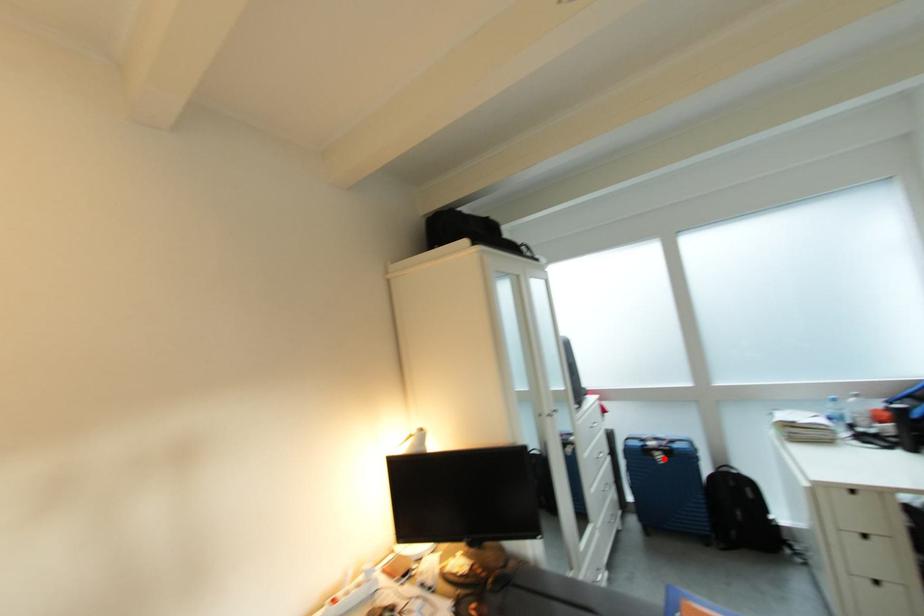
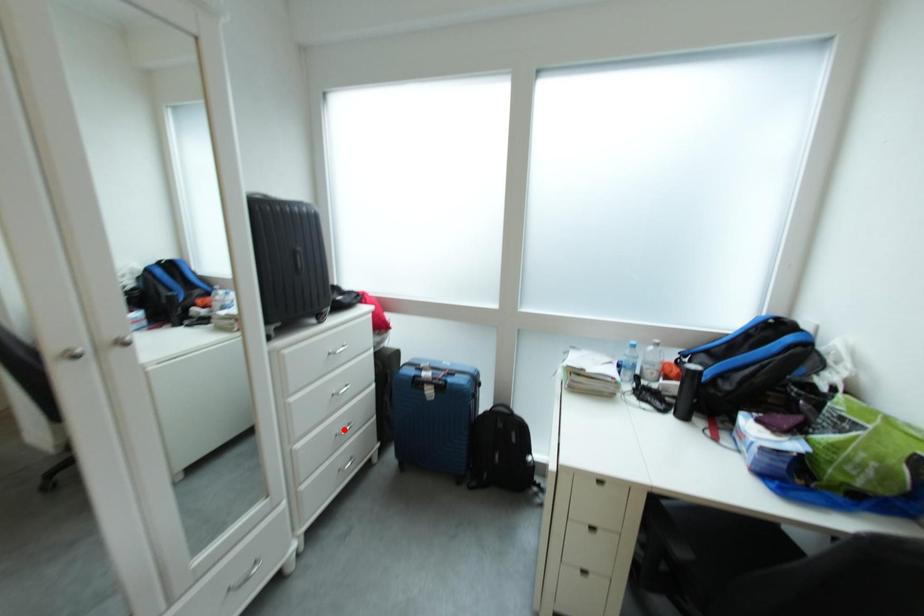
I am providing you with two images of the same scene from different viewpoints. A red point is marked on the first image and another point is marked on the second image. Does the point marked in image1 correspond to the same location as the one in image2?

No